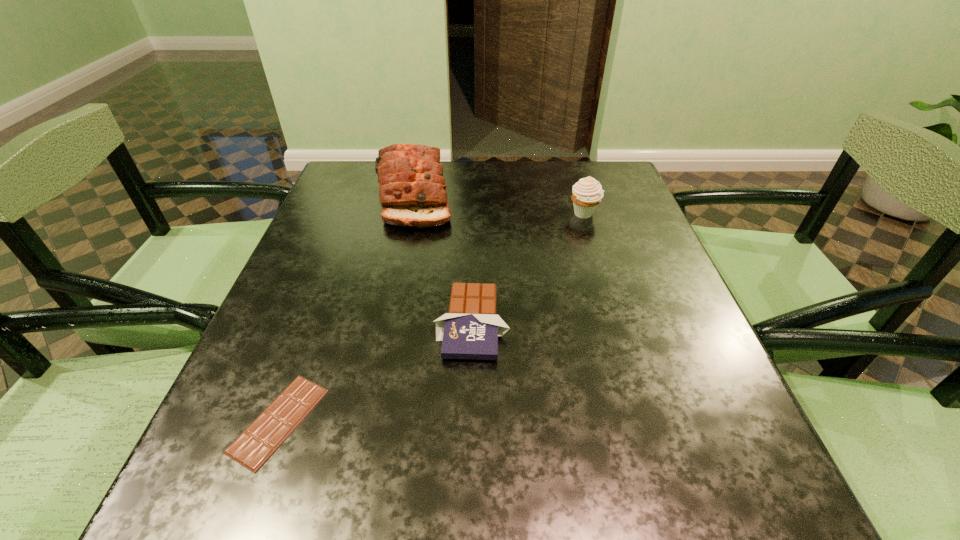
Locate an element on the screen. Image resolution: width=960 pixels, height=540 pixels. bread located in the far edge section of the desktop is located at coordinates (412, 192).

Where is `muffin located at the far edge`? This screenshot has width=960, height=540. muffin located at the far edge is located at coordinates (587, 193).

Locate an element on the screen. object that is at the near edge is located at coordinates (268, 431).

At what (x,y) coordinates should I click in order to perform the action: click on bread at the left edge. Please return your answer as a coordinate pair (x, y). Looking at the image, I should click on (412, 192).

You are a GUI agent. You are given a task and a screenshot of the screen. Output one action in this format:
    pyautogui.click(x=<x>, y=<y>)
    Task: Click on the chocolate bar present at the left edge
    
    Given the screenshot: What is the action you would take?
    pyautogui.click(x=268, y=431)

This screenshot has height=540, width=960. What are the coordinates of `object at the right edge` in the screenshot? It's located at (587, 193).

What are the coordinates of `object located in the far left corner section of the desktop` in the screenshot? It's located at click(x=412, y=192).

Identify the location of object that is at the near left corner. (268, 431).

Identify the location of object at the far right corner. The width and height of the screenshot is (960, 540). (587, 193).

Locate an element on the screen. Image resolution: width=960 pixels, height=540 pixels. free space at the far edge of the desktop is located at coordinates (527, 163).